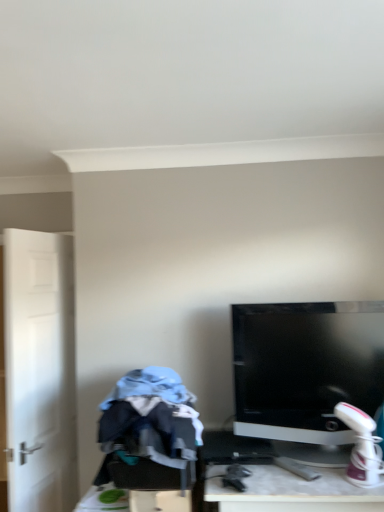
Question: From the image's perspective, does white matte door at left appear lower than blue cotton hoodie at left?

Choices:
 (A) no
 (B) yes

Answer: (A)

Question: Is white matte door at left positioned before blue cotton hoodie at left?

Choices:
 (A) no
 (B) yes

Answer: (A)

Question: Considering the relative sizes of white matte door at left and blue cotton hoodie at left in the image provided, is white matte door at left thinner than blue cotton hoodie at left?

Choices:
 (A) yes
 (B) no

Answer: (A)

Question: Is white matte door at left surrounding blue cotton hoodie at left?

Choices:
 (A) yes
 (B) no

Answer: (B)

Question: From a real-world perspective, is white matte door at left beneath blue cotton hoodie at left?

Choices:
 (A) no
 (B) yes

Answer: (A)

Question: Considering the relative positions of white matte door at left and blue cotton hoodie at left in the image provided, is white matte door at left behind blue cotton hoodie at left?

Choices:
 (A) no
 (B) yes

Answer: (B)

Question: Is satin black monitor at center not inside blue cotton hoodie at left?

Choices:
 (A) yes
 (B) no

Answer: (A)

Question: Does satin black monitor at center have a lesser height compared to blue cotton hoodie at left?

Choices:
 (A) no
 (B) yes

Answer: (A)

Question: Is the depth of satin black monitor at center less than that of blue cotton hoodie at left?

Choices:
 (A) no
 (B) yes

Answer: (A)

Question: From a real-world perspective, is satin black monitor at center beneath blue cotton hoodie at left?

Choices:
 (A) no
 (B) yes

Answer: (A)

Question: Is blue cotton hoodie at left located within satin black monitor at center?

Choices:
 (A) yes
 (B) no

Answer: (B)

Question: Can you confirm if satin black monitor at center is positioned to the right of blue cotton hoodie at left?

Choices:
 (A) yes
 (B) no

Answer: (A)

Question: Is blue cotton hoodie at left bigger than white matte door at left?

Choices:
 (A) no
 (B) yes

Answer: (A)